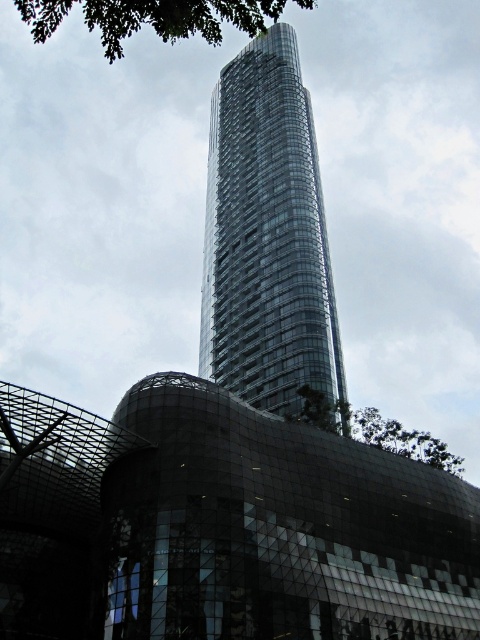
Is point (48, 26) closer to camera compared to point (357, 416)?

Yes.

Which of these two, green leafy tree at upper left or green leafy tree at upper center, stands taller?

With more height is green leafy tree at upper left.

This screenshot has height=640, width=480. In order to click on green leafy tree at upper left in this screenshot , I will do `click(154, 17)`.

This screenshot has width=480, height=640. Find the location of `green leafy tree at upper left`. green leafy tree at upper left is located at coordinates (154, 17).

Does point (323, 259) lie in front of point (359, 436)?

That is False.

Which is more to the right, transparent glass tower at center or green leafy tree at upper center?

Positioned to the right is green leafy tree at upper center.

Which is behind, point (238, 253) or point (332, 420)?

The point (238, 253) is more distant.

In order to click on transparent glass tower at center in this screenshot , I will do `click(266, 236)`.

Does transparent glass tower at center appear on the left side of green leafy tree at upper left?

No, transparent glass tower at center is not to the left of green leafy tree at upper left.

Measure the distance from transparent glass tower at center to green leafy tree at upper left.

transparent glass tower at center is 39.46 meters from green leafy tree at upper left.

Locate an element on the screen. The image size is (480, 640). transparent glass tower at center is located at coordinates (266, 236).